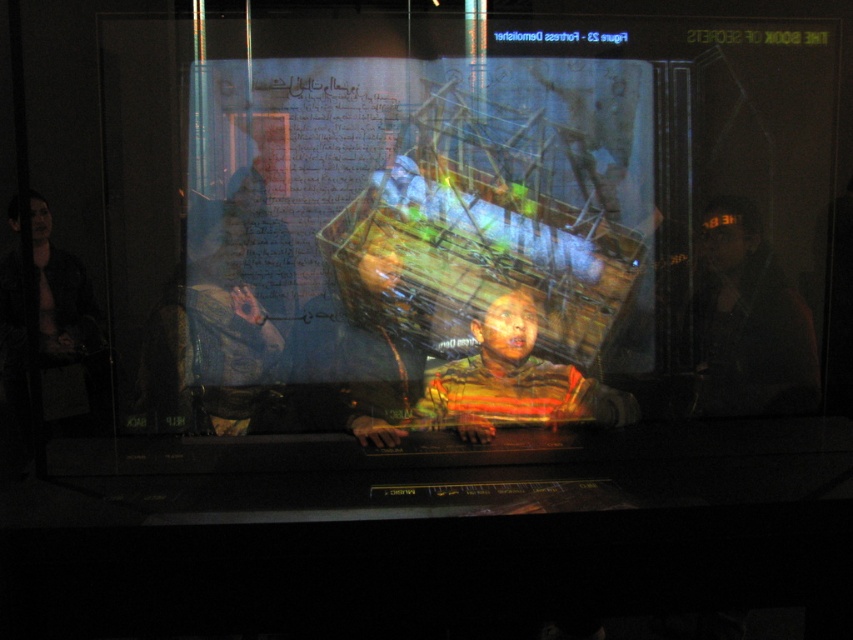
Is dark hair at right smaller than striped fabric child at center?

Indeed, dark hair at right has a smaller size compared to striped fabric child at center.

Is dark hair at right wider than striped fabric child at center?

No, dark hair at right is not wider than striped fabric child at center.

This screenshot has height=640, width=853. Find the location of `dark hair at right`. dark hair at right is located at coordinates (749, 323).

Where is `dark hair at right`? dark hair at right is located at coordinates (749, 323).

Between striped fabric child at center and dark brown leather jacket at left, which one appears on the right side from the viewer's perspective?

striped fabric child at center is more to the right.

Which is behind, point (518, 292) or point (86, 417)?

The point (86, 417) is behind.

Between point (490, 400) and point (9, 342), which one is positioned in front?

Point (490, 400) is more forward.

Identify the location of striped fabric child at center. Image resolution: width=853 pixels, height=640 pixels. (514, 381).

Is the position of matte blue shirt at center less distant than that of striped fabric child at center?

No, matte blue shirt at center is behind striped fabric child at center.

Does point (228, 296) come closer to viewer compared to point (613, 406)?

No.

Image resolution: width=853 pixels, height=640 pixels. I want to click on matte blue shirt at center, so coord(207,332).